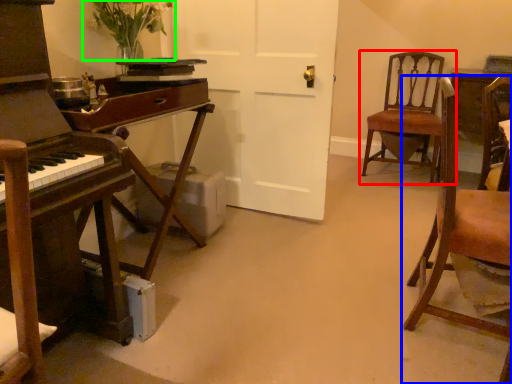
Question: Which object is positioned closest to chair (highlighted by a red box)? Select from chair (highlighted by a blue box) and floral arrangement (highlighted by a green box).

Choices:
 (A) chair
 (B) floral arrangement

Answer: (A)